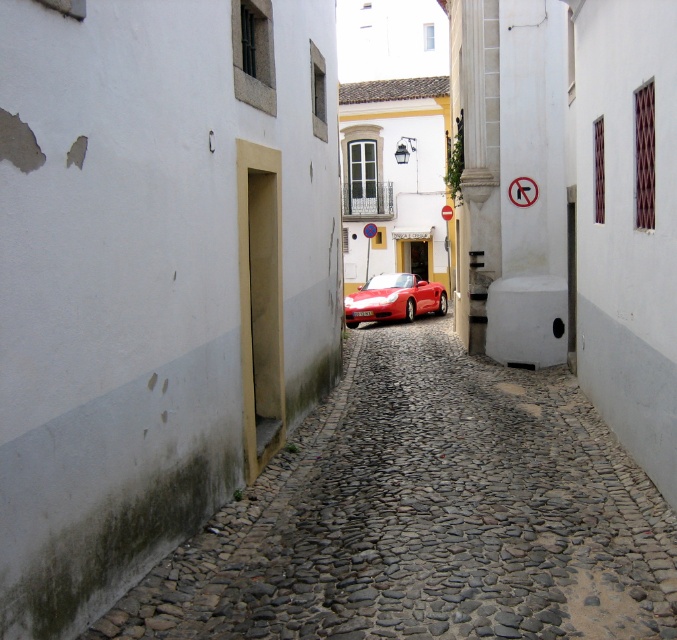
Between smooth cobblestone alley at center and shiny red convertible at center, which one appears on the right side from the viewer's perspective?

smooth cobblestone alley at center

Does smooth cobblestone alley at center appear under shiny red convertible at center?

Yes, smooth cobblestone alley at center is below shiny red convertible at center.

Is point (240, 618) closer to viewer compared to point (393, 282)?

That is True.

Where is `smooth cobblestone alley at center`? The image size is (677, 640). smooth cobblestone alley at center is located at coordinates (427, 515).

Describe the element at coordinates (393, 298) in the screenshot. I see `shiny red convertible at center` at that location.

At what (x,y) coordinates should I click in order to perform the action: click on shiny red convertible at center. Please return your answer as a coordinate pair (x, y). This screenshot has height=640, width=677. Looking at the image, I should click on (393, 298).

Find the location of a particular element. shiny red convertible at center is located at coordinates (393, 298).

Which is behind, point (649, 540) or point (366, 250)?

The point (366, 250) is behind.

Is point (433, 547) behind point (366, 259)?

No.

I want to click on smooth cobblestone alley at center, so click(427, 515).